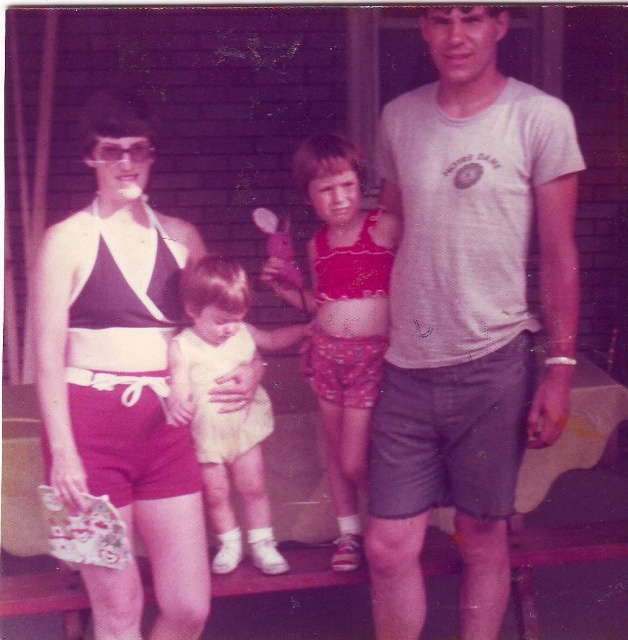
You are a photographer trying to focus on two points in the image. The first point is at coordinates point (482, 513) and the second is at point (99, 420). Which point is closer to your camera lens?

Point (482, 513) is further to the camera than point (99, 420), so the second point is closer to the camera lens.